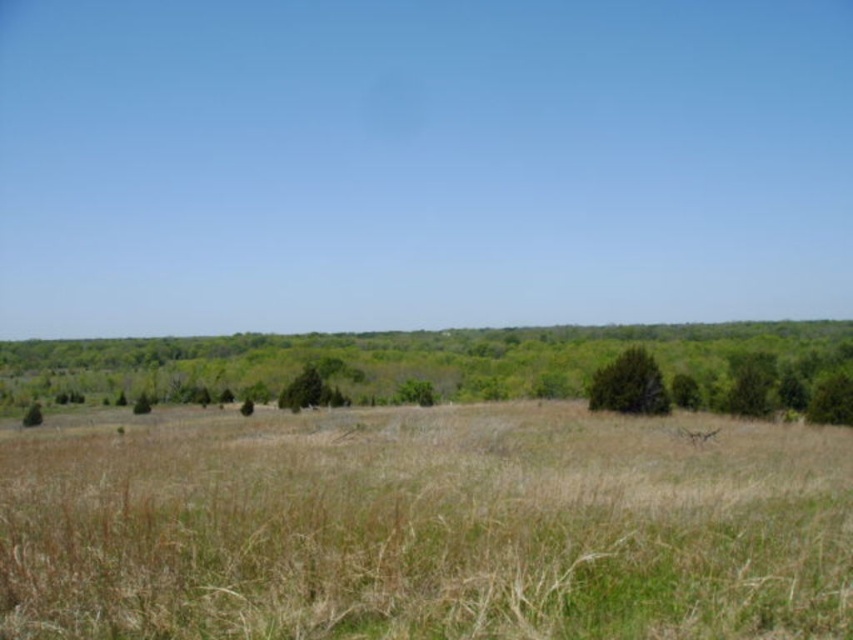
Question: Is dry grass at center closer to camera compared to green leafy tree at center?

Choices:
 (A) yes
 (B) no

Answer: (A)

Question: Is dry grass at center positioned before green matte tree at center?

Choices:
 (A) no
 (B) yes

Answer: (B)

Question: Among these objects, which one is nearest to the camera?

Choices:
 (A) green matte tree at center-right
 (B) green matte tree at center

Answer: (A)

Question: Which point is farther from the camera taking this photo?

Choices:
 (A) (618, 364)
 (B) (805, 492)
 (C) (479, 392)
 (D) (341, 394)

Answer: (C)

Question: Can you confirm if dry grass at center is bigger than green matte tree at center?

Choices:
 (A) yes
 (B) no

Answer: (A)

Question: Which object is farther from the camera taking this photo?

Choices:
 (A) dry grass at center
 (B) green matte tree at center-right

Answer: (B)